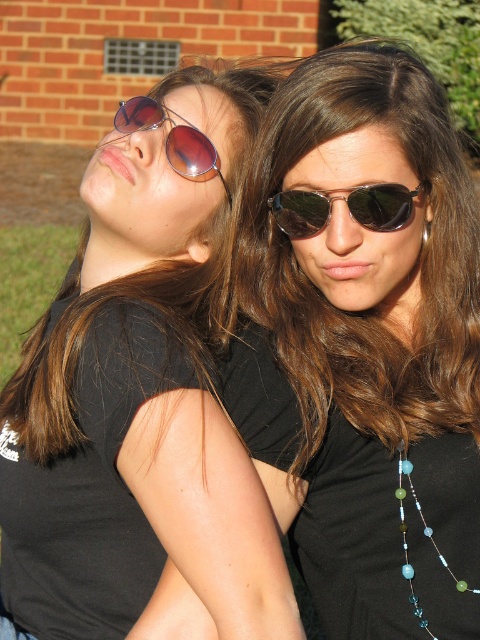
Question: Does shiny black sunglasses at center come behind shiny dark sunglasses at center?

Choices:
 (A) yes
 (B) no

Answer: (B)

Question: Considering the real-world distances, which object is farthest from the shiny dark sunglasses at center?

Choices:
 (A) shiny black sunglasses at center
 (B) matte black sunglasses at upper left
 (C) metallic reflective sunglasses at upper center
 (D) translucent glass beads at center

Answer: (D)

Question: Does shiny dark sunglasses at center have a greater width compared to metallic reflective sunglasses at upper center?

Choices:
 (A) no
 (B) yes

Answer: (B)

Question: Which point is closer to the camera?

Choices:
 (A) translucent glass beads at center
 (B) shiny black sunglasses at center
 (C) matte black sunglasses at upper left
 (D) shiny dark sunglasses at center

Answer: (C)

Question: Where is matte black sunglasses at upper left located in relation to translucent glass beads at center in the image?

Choices:
 (A) below
 (B) above

Answer: (B)

Question: Which of the following is the closest to the observer?

Choices:
 (A) metallic reflective sunglasses at upper center
 (B) translucent glass beads at center
 (C) shiny black sunglasses at center
 (D) shiny dark sunglasses at center

Answer: (C)